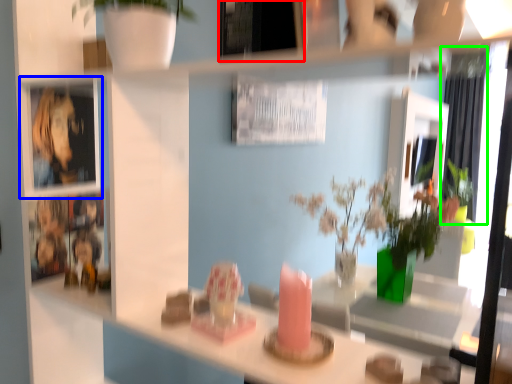
Question: Which object is the farthest from picture frame (highlighted by a red box)? Choose among these: cabinet (highlighted by a blue box) or curtain (highlighted by a green box).

Choices:
 (A) cabinet
 (B) curtain

Answer: (B)